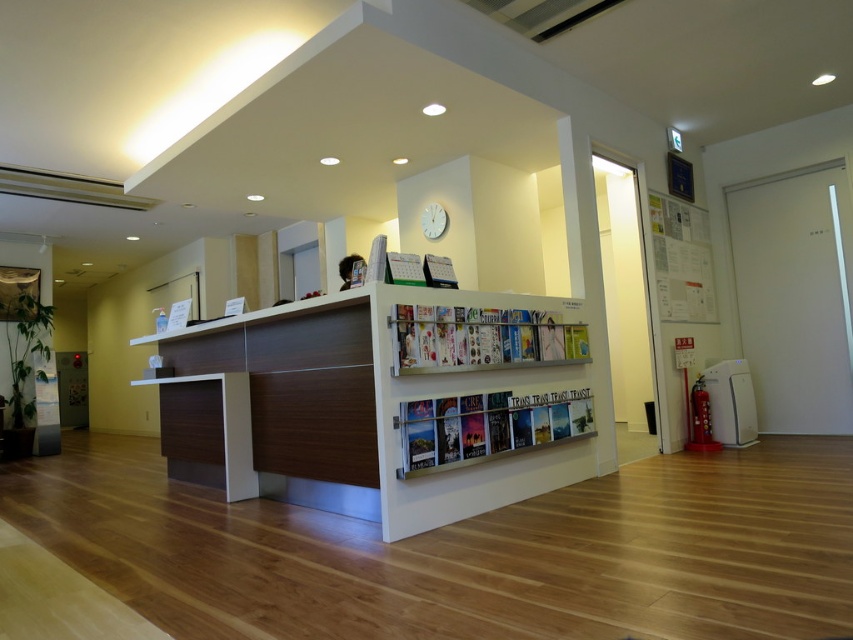
Is matte white book at center shorter than white glossy magazine at center?

No.

Describe the element at coordinates (486, 426) in the screenshot. The height and width of the screenshot is (640, 853). I see `matte white book at center` at that location.

Between point (560, 403) and point (489, 349), which one is positioned in front?

Point (489, 349) is in front.

Where is `matte white book at center`? This screenshot has width=853, height=640. matte white book at center is located at coordinates (486, 426).

Is matte white book at center above white paperboard at upper right?

Actually, matte white book at center is below white paperboard at upper right.

Which of these two, matte white book at center or white paperboard at upper right, stands taller?

With more height is white paperboard at upper right.

This screenshot has height=640, width=853. In order to click on matte white book at center in this screenshot , I will do `click(486, 426)`.

Can you confirm if wooden magazine rack at center is bigger than white matte clock at upper center?

Correct, wooden magazine rack at center is larger in size than white matte clock at upper center.

Is wooden magazine rack at center shorter than white matte clock at upper center?

No.

Is point (534, 332) farther from camera compared to point (434, 212)?

No, (534, 332) is in front of (434, 212).

The width and height of the screenshot is (853, 640). What are the coordinates of `wooden magazine rack at center` in the screenshot? It's located at (392, 400).